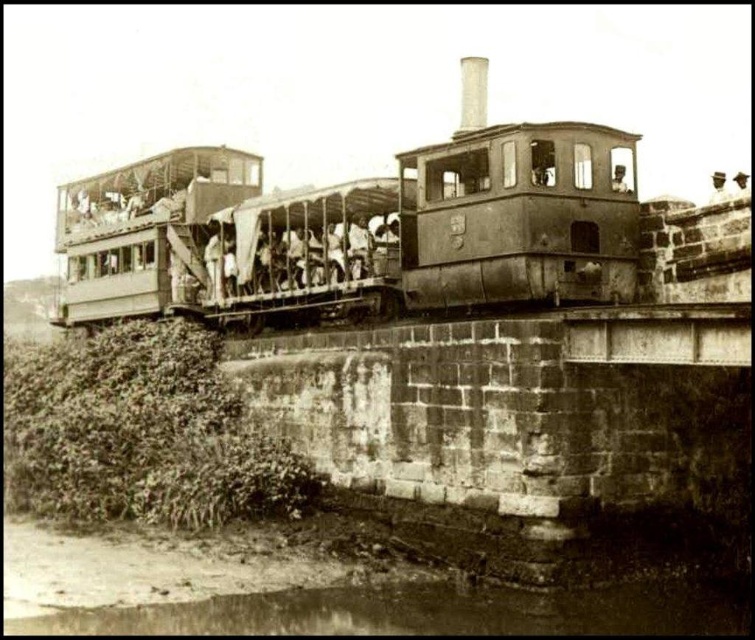
You are a photographer standing at the scene of the vintage steam train crossing the stone bridge. You want to capture a photo where both the rusty metal train at center and the brown dirt river at lower left are visible. Considering their sizes, which object will occupy more space in your photo?

The rusty metal train at center will occupy more space in the photo because it is larger in size than the brown dirt river at lower left according to the description.

You are standing at the point with coordinates [359,227]. What object is exactly at your current location?

The rusty metal train at center is located at point [359,227].

You are a railway engineer planning to replace the rusty metal train at center with a new one. The new train is 10 feet shorter than the old one. How much space will be saved?

The rusty metal train at center is 58.56 feet long. The new train is 10 feet shorter, so the space saved would be 10 feet.